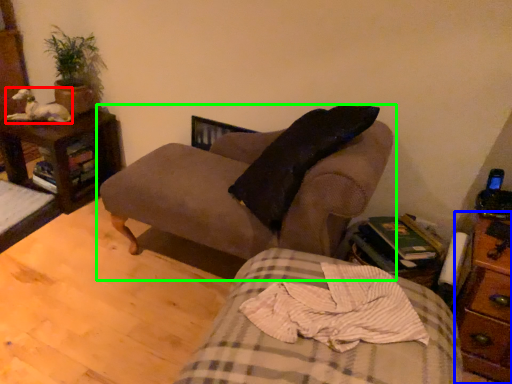
Question: Based on their relative distances, which object is farther from animal (highlighted by a red box)? Choose from nightstand (highlighted by a blue box) and studio couch (highlighted by a green box).

Choices:
 (A) nightstand
 (B) studio couch

Answer: (A)